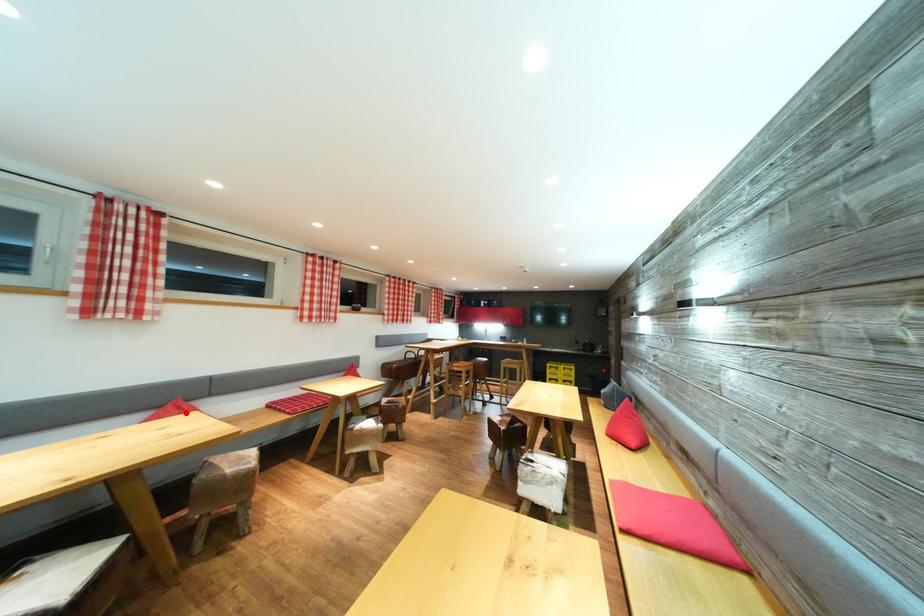
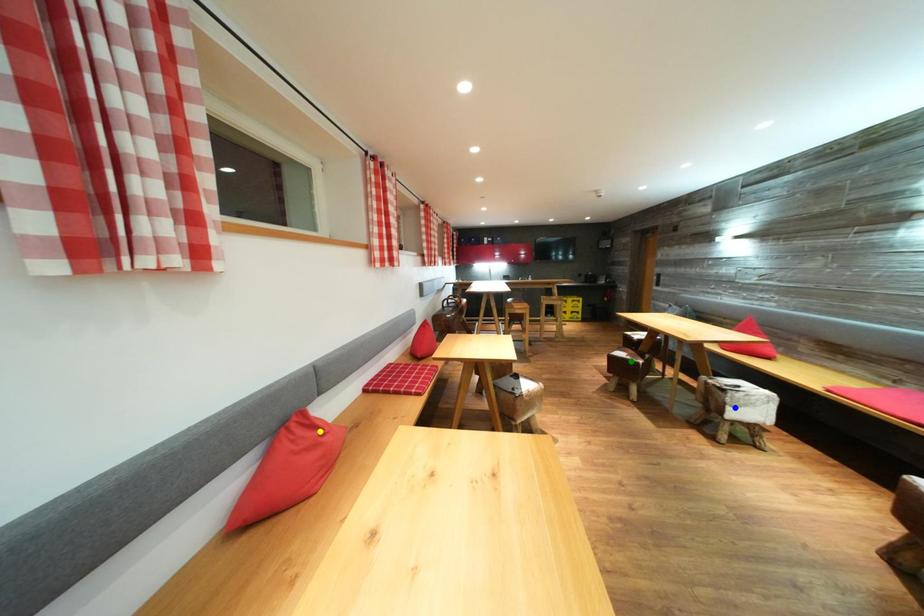
Question: I am providing you with two images of the same scene from different viewpoints. A red point is marked on the first image. You are given multiple points on the second image. Which point in image 2 represents the same 3d spot as the red point in image 1?

Choices:
 (A) blue point
 (B) yellow point
 (C) green point

Answer: (B)